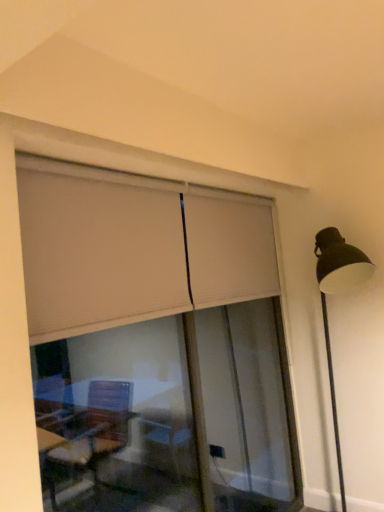
Question: Is matte black lamp post at right facing towards white matte window frame at upper center?

Choices:
 (A) yes
 (B) no

Answer: (B)

Question: Is matte black lamp post at right bigger than white matte window frame at upper center?

Choices:
 (A) yes
 (B) no

Answer: (A)

Question: Can you confirm if matte black lamp post at right is positioned to the right of white matte window frame at upper center?

Choices:
 (A) yes
 (B) no

Answer: (A)

Question: From the image's perspective, is matte black lamp post at right beneath white matte window frame at upper center?

Choices:
 (A) no
 (B) yes

Answer: (B)

Question: Is the position of matte black lamp post at right less distant than that of white matte window frame at upper center?

Choices:
 (A) yes
 (B) no

Answer: (B)

Question: In terms of height, does beige fabric curtain at upper center look taller or shorter compared to matte black lamp post at right?

Choices:
 (A) short
 (B) tall

Answer: (A)

Question: From a real-world perspective, relative to matte black lamp post at right, is beige fabric curtain at upper center vertically above or below?

Choices:
 (A) below
 (B) above

Answer: (B)

Question: Considering the positions of beige fabric curtain at upper center and matte black lamp post at right in the image, is beige fabric curtain at upper center bigger or smaller than matte black lamp post at right?

Choices:
 (A) big
 (B) small

Answer: (B)

Question: Does point (46, 165) appear closer or farther from the camera than point (319, 249)?

Choices:
 (A) closer
 (B) farther

Answer: (A)

Question: Based on their sizes in the image, would you say matte black lamp post at right is bigger or smaller than beige fabric curtain at upper center?

Choices:
 (A) small
 (B) big

Answer: (B)

Question: Is matte black lamp post at right in front of or behind beige fabric curtain at upper center in the image?

Choices:
 (A) front
 (B) behind

Answer: (B)

Question: From the image's perspective, is matte black lamp post at right above or below beige fabric curtain at upper center?

Choices:
 (A) below
 (B) above

Answer: (A)

Question: From their relative heights in the image, would you say matte black lamp post at right is taller or shorter than beige fabric curtain at upper center?

Choices:
 (A) short
 (B) tall

Answer: (B)

Question: In the image, is white matte window frame at upper center positioned in front of or behind matte black lamp post at right?

Choices:
 (A) behind
 (B) front

Answer: (B)

Question: From the image's perspective, is white matte window frame at upper center positioned above or below matte black lamp post at right?

Choices:
 (A) above
 (B) below

Answer: (A)